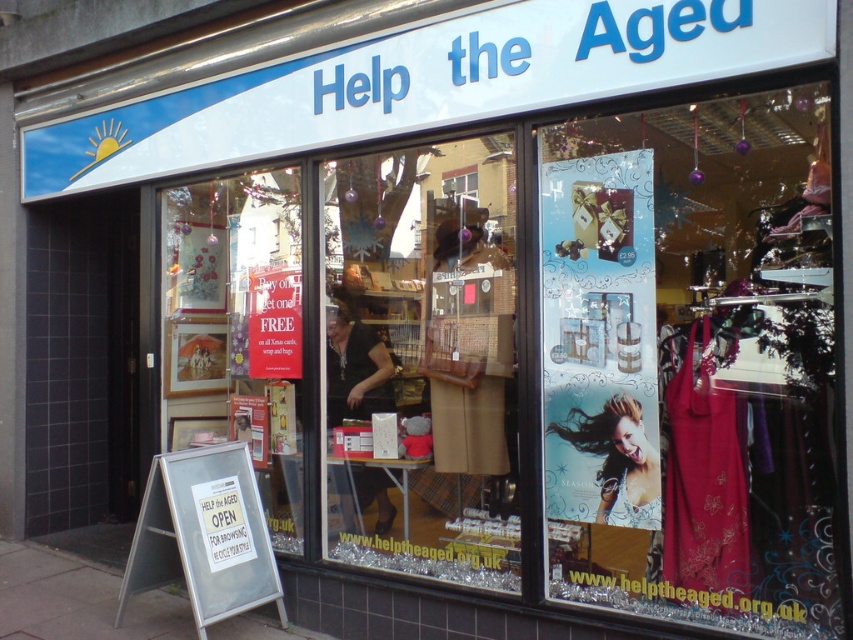
You are standing 2 meters away from the camera position. You want to touch the metallic silver poster at center. How many more meters do you need to walk forward?

The metallic silver poster at center is 3.04 meters away from the camera. Since you are already 2 meters away from the camera position, you need to walk an additional 1.04 meters forward to reach it.

You are a customer entering the Help the Aged charity shop. You see a metallic silver poster at center and a shiny silver hair at center. Which object is closer to you as you face the storefront?

The metallic silver poster at center is closer to you because it is in front of the shiny silver hair at center.

You are a customer entering the Help the Aged charity shop. You notice two items at the center of the store window. Which one is wider, the metallic silver poster at center or the shiny silver hair at center?

The metallic silver poster at center is wider than the shiny silver hair at center.